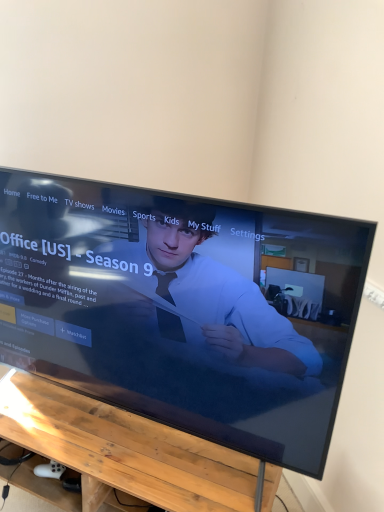
Question: From a real-world perspective, relative to black glossy tv at center, is wooden table at lower center vertically above or below?

Choices:
 (A) above
 (B) below

Answer: (B)

Question: Is point (188, 478) closer or farther from the camera than point (56, 330)?

Choices:
 (A) closer
 (B) farther

Answer: (A)

Question: In terms of width, does wooden table at lower center look wider or thinner when compared to black glossy tv at center?

Choices:
 (A) wide
 (B) thin

Answer: (A)

Question: Is black glossy tv at center bigger or smaller than wooden table at lower center?

Choices:
 (A) big
 (B) small

Answer: (A)

Question: From the image's perspective, relative to wooden table at lower center, is black glossy tv at center above or below?

Choices:
 (A) above
 (B) below

Answer: (A)

Question: Looking at their shapes, would you say black glossy tv at center is wider or thinner than wooden table at lower center?

Choices:
 (A) wide
 (B) thin

Answer: (B)

Question: From a real-world perspective, is black glossy tv at center positioned above or below wooden table at lower center?

Choices:
 (A) below
 (B) above

Answer: (B)